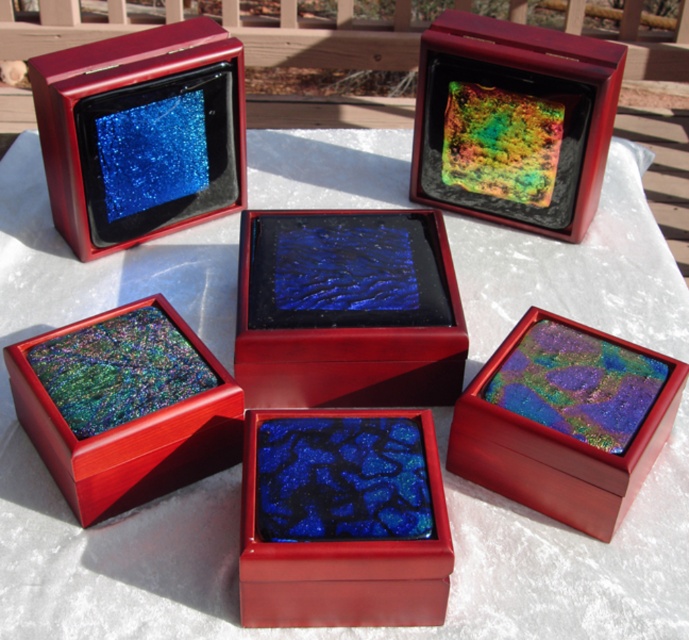
Based on the photo, you are an interior designer arranging items on a table. You have a glossy blue stone at center and a shiny purple glass box at center. Which item is more to the left?

The glossy blue stone at center is positioned on the left side of the shiny purple glass box at center, so it is more to the left.

You are a delivery person who needs to place a new package that is 16 inches long between the matte black box at upper left and the multicolored glass mosaic at upper center. Can the package fit in the space between them?

The matte black box at upper left is 16.27 inches away from the multicolored glass mosaic at upper center. Since the package is 16 inches long, it can fit in the space between them as the distance is slightly larger than the package length.